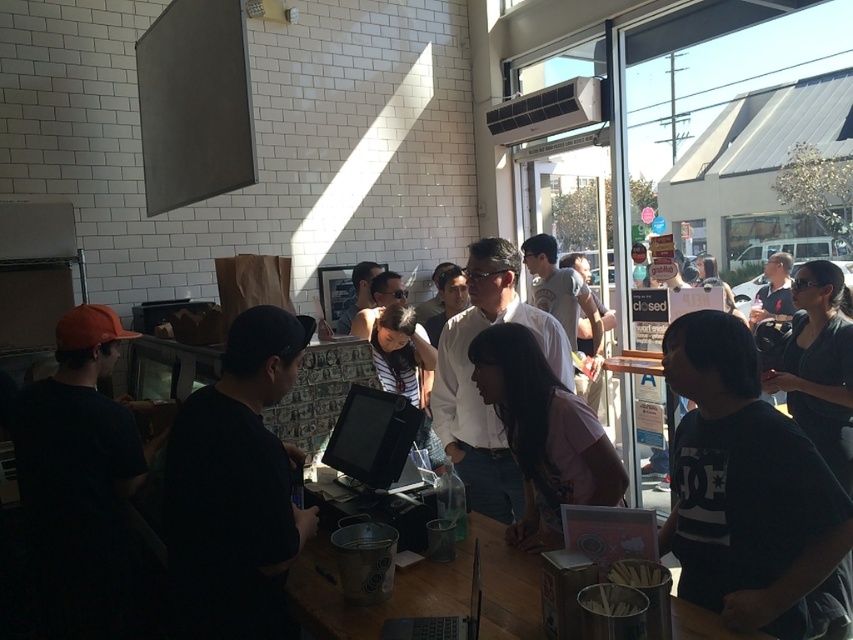
You are standing at the entrance of the eatery and want to go to the point marked as point (616, 502). However, there is an obstacle at point (772, 518). Can you walk directly to your destination without going around the obstacle?

The point (772, 518) is in front of point (616, 502), so you cannot walk directly to point (616, 502) without going around the obstacle at point (772, 518).